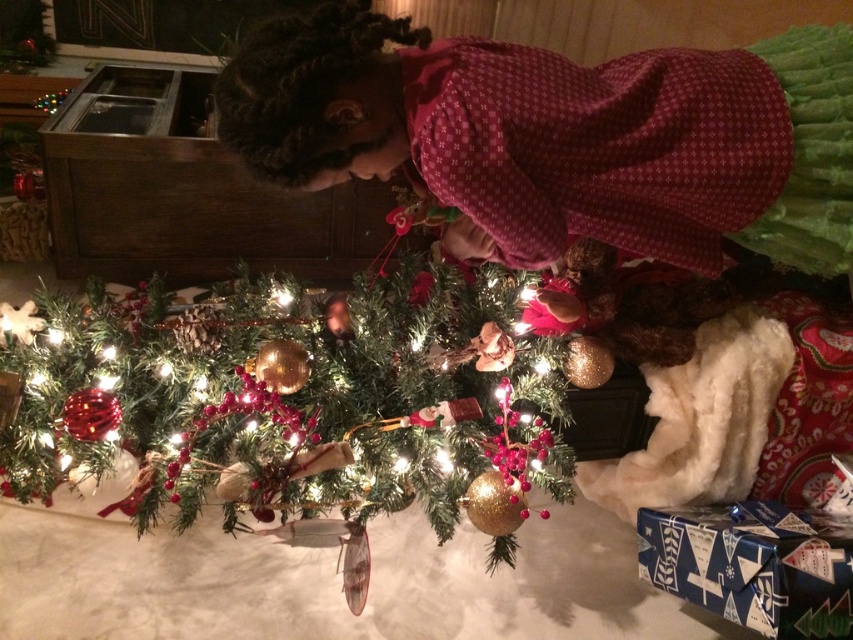
Does matte red dress at center have a greater height compared to green textured christmas tree at center?

No.

Which is behind, point (376, 108) or point (51, 385)?

Point (51, 385)

Find the location of a particular element. matte red dress at center is located at coordinates (563, 134).